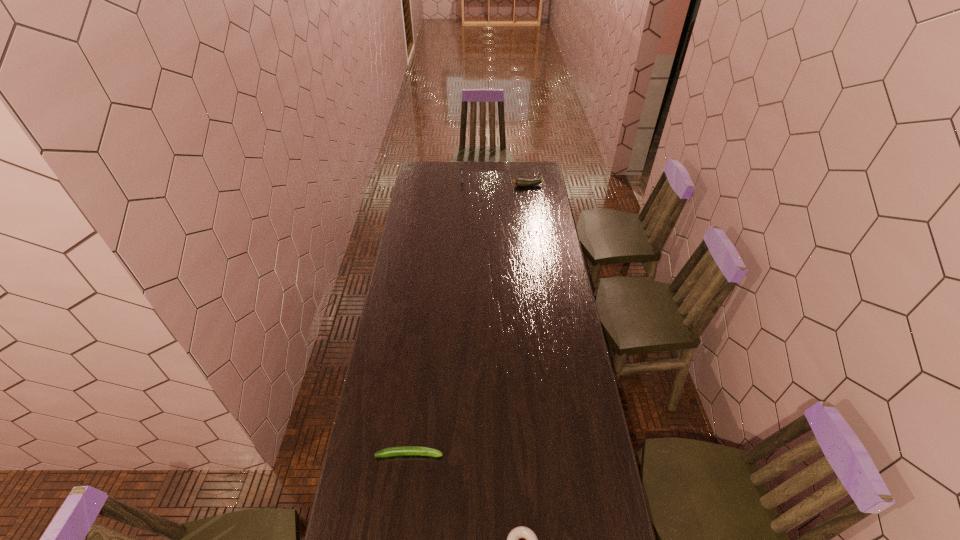
Where is `igniter`? The width and height of the screenshot is (960, 540). igniter is located at coordinates (461, 172).

Locate an element on the screen. The width and height of the screenshot is (960, 540). the tallest object is located at coordinates (461, 172).

At what (x,y) coordinates should I click in order to perform the action: click on the right zucchini. Please return your answer as a coordinate pair (x, y). The width and height of the screenshot is (960, 540). Looking at the image, I should click on (519, 182).

I want to click on the taller zucchini, so click(x=519, y=182).

This screenshot has width=960, height=540. In order to click on the second nearest object in this screenshot , I will do `click(400, 450)`.

Locate an element on the screen. the shorter zucchini is located at coordinates (400, 450).

At what (x,y) coordinates should I click in order to perform the action: click on free space located 0.050m on the back of the igniter. Please return your answer as a coordinate pair (x, y). Looking at the image, I should click on (463, 172).

This screenshot has height=540, width=960. I want to click on vacant point located at the blossom end of the second tallest object, so click(x=447, y=186).

Where is `vacant space located at the blossom end of the second tallest object`? This screenshot has height=540, width=960. vacant space located at the blossom end of the second tallest object is located at coordinates (464, 186).

This screenshot has width=960, height=540. Identify the location of free space located 0.340m at the blossom end of the second tallest object. (457, 186).